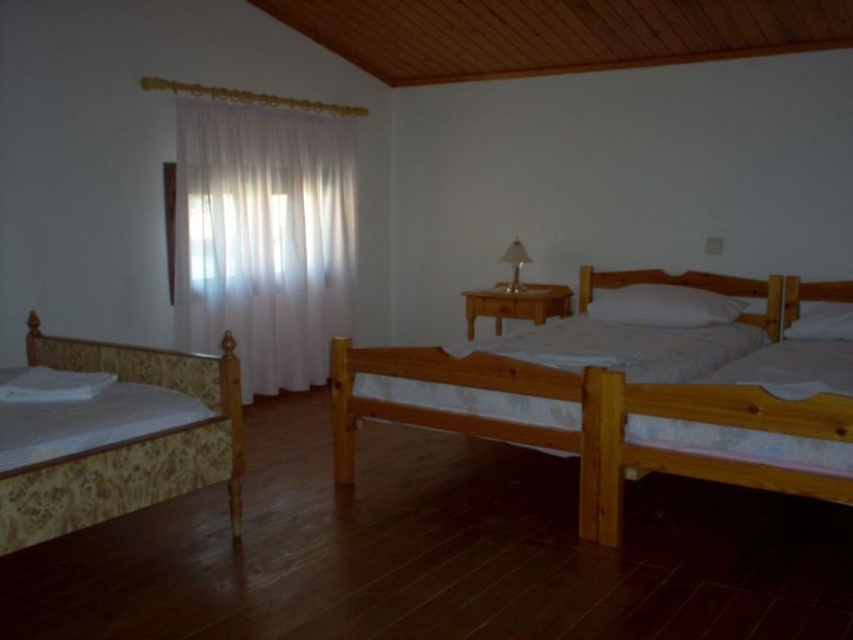
You are standing in the bedroom and want to move from the point at coordinates point [280,138] to the point at coordinates point [614,314]. Which direction should you move to get closer to your destination?

To move from point [280,138] to point [614,314], you should move forward because point [280,138] is behind point [614,314].

You are standing in the bedroom and want to reach the white soft pillow at center. The white sheer curtain at left is in your way. Can you move around the curtain to get to the pillow?

The white soft pillow at center is behind the white sheer curtain at left, so you can move around the curtain to access the pillow since it is positioned in front of the pillow.